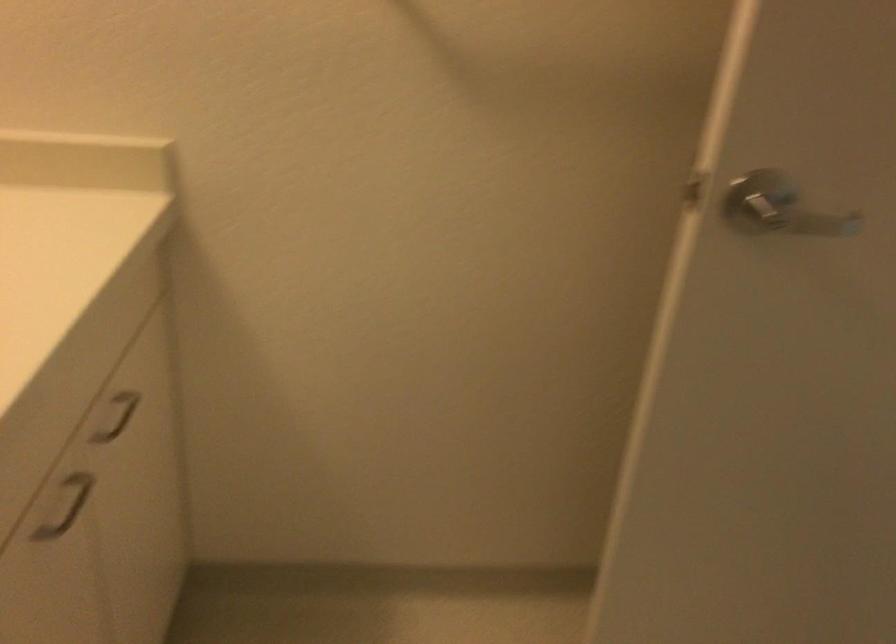
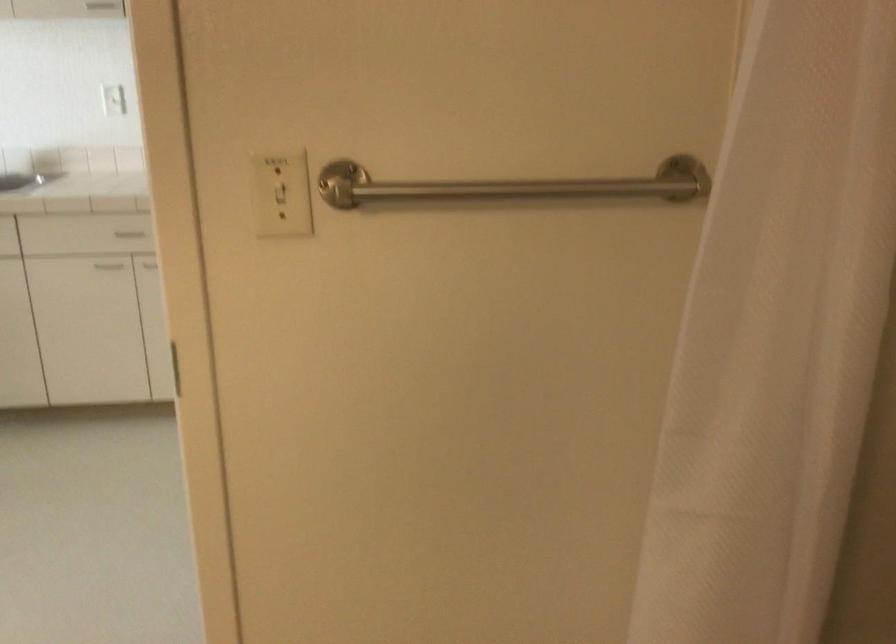
Question: How did the camera likely rotate?

Choices:
 (A) Left
 (B) Right
 (C) Up
 (D) Down

Answer: (B)